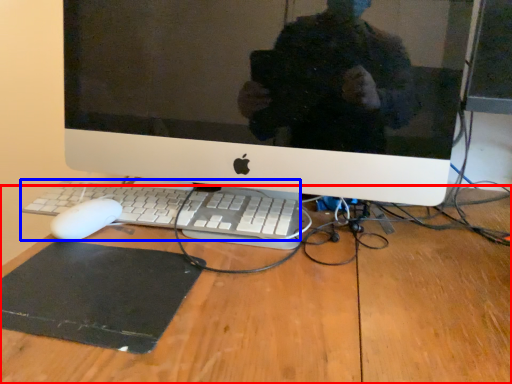
Question: Which point is closer to the camera, desk (highlighted by a red box) or computer keyboard (highlighted by a blue box)?

Choices:
 (A) desk
 (B) computer keyboard

Answer: (A)